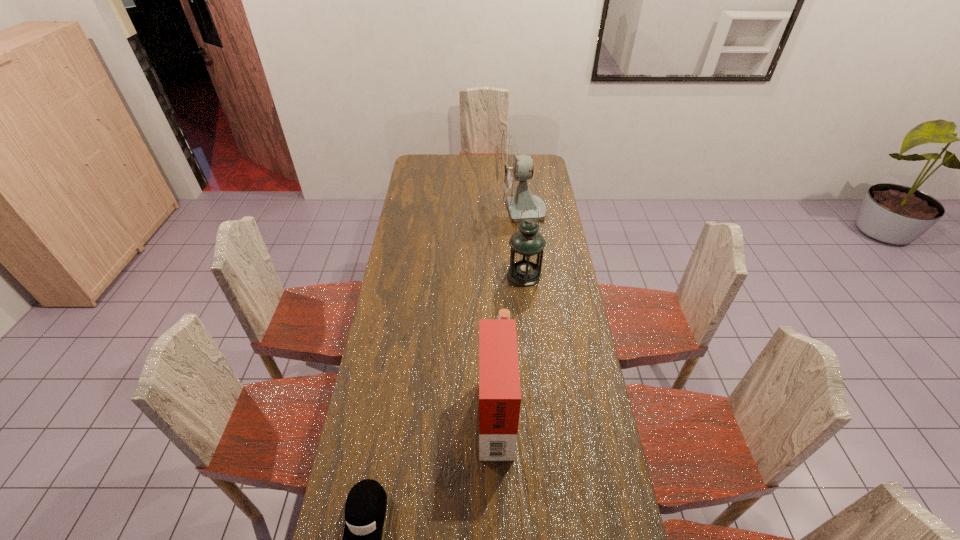
This screenshot has width=960, height=540. Find the location of `vacant space located 0.130m on the front-facing side of the third farthest object`. vacant space located 0.130m on the front-facing side of the third farthest object is located at coordinates (440, 411).

The width and height of the screenshot is (960, 540). Find the location of `fan that is at the right edge`. fan that is at the right edge is located at coordinates pyautogui.click(x=512, y=171).

Image resolution: width=960 pixels, height=540 pixels. I want to click on oil lamp present at the right edge, so click(527, 244).

Image resolution: width=960 pixels, height=540 pixels. What are the coordinates of `free space at the far edge of the desktop` in the screenshot? It's located at (463, 168).

You are a GUI agent. You are given a task and a screenshot of the screen. Output one action in this format:
    pyautogui.click(x=<x>, y=<y>)
    Task: Click on the free space at the left edge
    
    Given the screenshot: What is the action you would take?
    pyautogui.click(x=377, y=408)

This screenshot has width=960, height=540. In the image, there is a desktop. What are the coordinates of `vacant space at the right edge` in the screenshot? It's located at (589, 431).

In the image, there is a desktop. Find the location of `vacant area at the far right corner`. vacant area at the far right corner is located at coordinates (535, 173).

You are a GUI agent. You are given a task and a screenshot of the screen. Output one action in this format:
    pyautogui.click(x=<x>, y=<y>)
    Task: Click on the object that stands as the second closest to the farthest object
    The height and width of the screenshot is (540, 960).
    Given the screenshot: What is the action you would take?
    pos(499,380)

Find the location of a particular element. This screenshot has height=540, width=960. object that can be found as the third closest to the leftmost object is located at coordinates (512, 171).